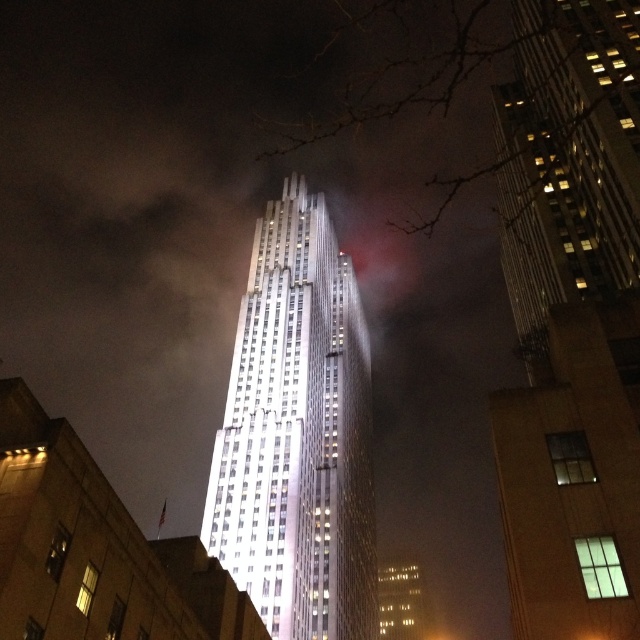
You are standing in the middle of a city square at night, facing the Rockefeller Center skyscraper. A friend tells you that the reflective glass skyscraper at center is exactly at coordinate point (572,317). If you want to take a photo of this point, where should you aim your camera relative to the center of the image?

You should aim your camera at the center of the image because the reflective glass skyscraper at center is represented by point (572,317), which corresponds to the center of the image.

You are standing in the middle of the street looking at the Rockefeller Center skyscraper. You notice two points marked on the building. One is at coordinates point (586,586) and the other is at point (276,292). Which point is closer to you?

Point (586,586) is in front of point (276,292), so it is closer to you.

You are a drone operator planning to fly a drone between the reflective glass skyscraper at center and the shiny glass tower at center. The drone has a maximum flight distance of 50 meters. Can the drone safely make the trip between them without exceeding its range?

The reflective glass skyscraper at center and the shiny glass tower at center are 47.14 meters apart, so the drone can safely fly between them as the distance is within its 50 meter range.